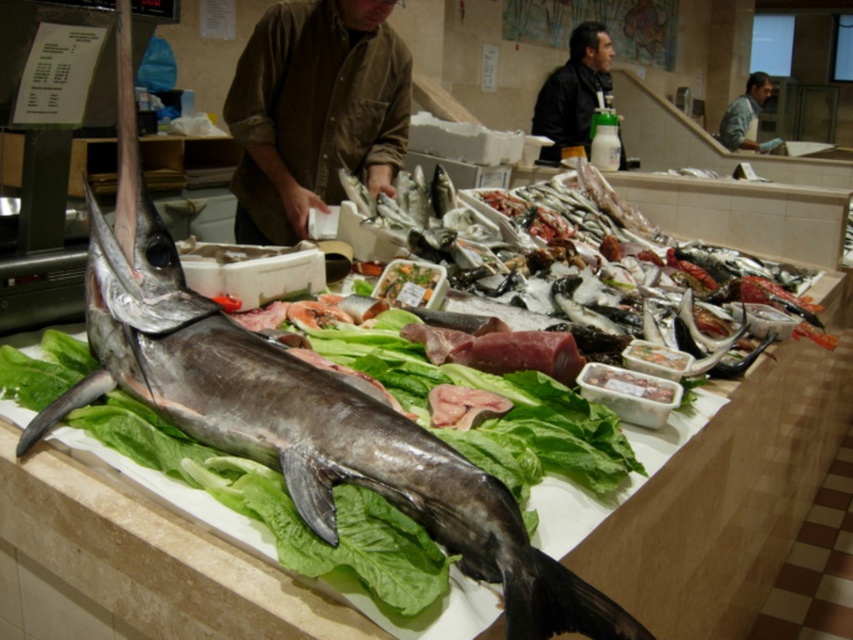
Question: Is brown cotton shirt at center to the left of grayish-blue shirt at upper center from the viewer's perspective?

Choices:
 (A) no
 (B) yes

Answer: (B)

Question: Which object appears farthest from the camera in this image?

Choices:
 (A) brown cotton shirt at center
 (B) dark brown leather jacket at upper center

Answer: (B)

Question: Does brown cotton shirt at center appear on the left side of dark brown leather jacket at upper center?

Choices:
 (A) yes
 (B) no

Answer: (A)

Question: Which of the following is the closest to the observer?

Choices:
 (A) grayish-blue shirt at upper center
 (B) brown cotton shirt at center
 (C) dark brown leather jacket at upper center

Answer: (B)

Question: Which of the following is the farthest from the observer?

Choices:
 (A) brown cotton shirt at center
 (B) grayish-blue shirt at upper center

Answer: (B)

Question: Where is brown cotton shirt at center located in relation to dark brown leather jacket at upper center in the image?

Choices:
 (A) left
 (B) right

Answer: (A)